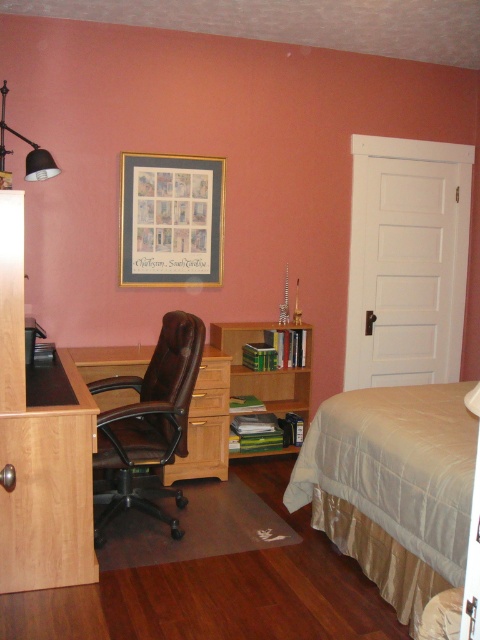
Question: From the image, what is the correct spatial relationship of wooden bookshelf at center in relation to matte black lamp at upper left?

Choices:
 (A) above
 (B) below

Answer: (B)

Question: Which object is positioned closest to the wooden drawer at center?

Choices:
 (A) matte black lamp at upper left
 (B) light brown wood dresser at left
 (C) brown wood drawer at center
 (D) beige satin bed at lower right

Answer: (C)

Question: Which point is closer to the camera?

Choices:
 (A) brown wood computer desk at center
 (B) beige satin bed at lower right
 (C) wooden drawer at center

Answer: (B)

Question: Which of the following is the closest to the observer?

Choices:
 (A) light brown wood dresser at left
 (B) beige satin bed at lower right
 (C) brown wood drawer at center
 (D) brown leather swivel chair at center

Answer: (B)

Question: Is brown leather swivel chair at center positioned behind matte black lamp at upper left?

Choices:
 (A) yes
 (B) no

Answer: (B)

Question: From the image, what is the correct spatial relationship of brown wood computer desk at center in relation to brown wood drawer at center?

Choices:
 (A) above
 (B) below

Answer: (A)